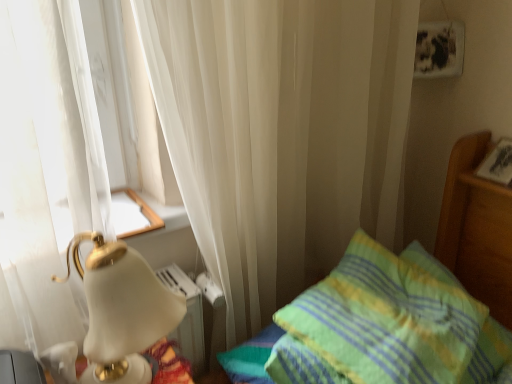
Question: Considering the positions of point (164, 299) and point (397, 367), is point (164, 299) closer or farther from the camera than point (397, 367)?

Choices:
 (A) farther
 (B) closer

Answer: (B)

Question: From a real-world perspective, is white glossy lamp at left positioned above or below green/yellow striped pillow at right?

Choices:
 (A) above
 (B) below

Answer: (A)

Question: Is white glossy lamp at left wider or thinner than green/yellow striped pillow at right?

Choices:
 (A) wide
 (B) thin

Answer: (B)

Question: From the image's perspective, is green/yellow striped pillow at right positioned above or below white glossy lamp at left?

Choices:
 (A) above
 (B) below

Answer: (B)

Question: In the image, is green/yellow striped pillow at right on the left side or the right side of white glossy lamp at left?

Choices:
 (A) right
 (B) left

Answer: (A)

Question: Considering the positions of green/yellow striped pillow at right and white glossy lamp at left in the image, is green/yellow striped pillow at right wider or thinner than white glossy lamp at left?

Choices:
 (A) thin
 (B) wide

Answer: (B)

Question: Is green/yellow striped pillow at right in front of or behind white glossy lamp at left in the image?

Choices:
 (A) behind
 (B) front

Answer: (A)